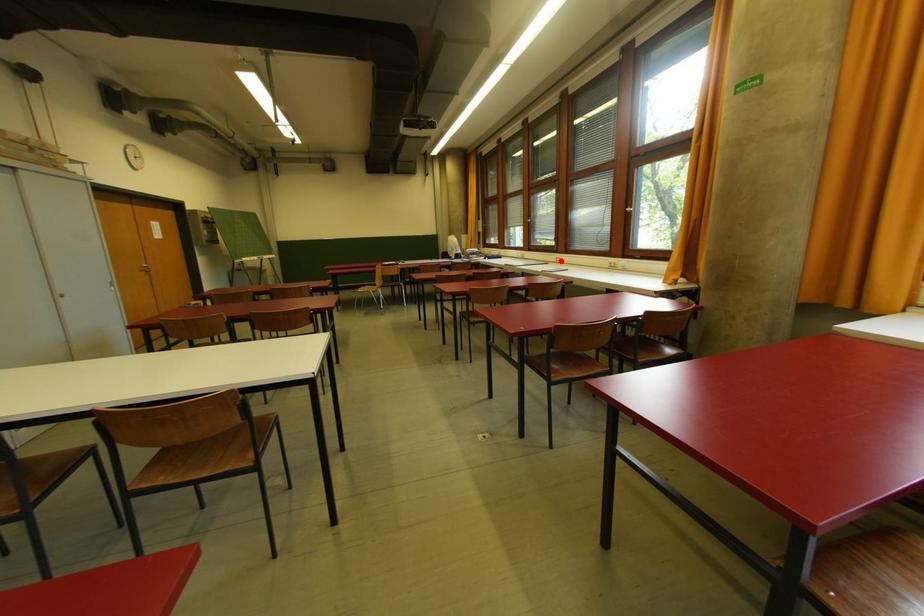
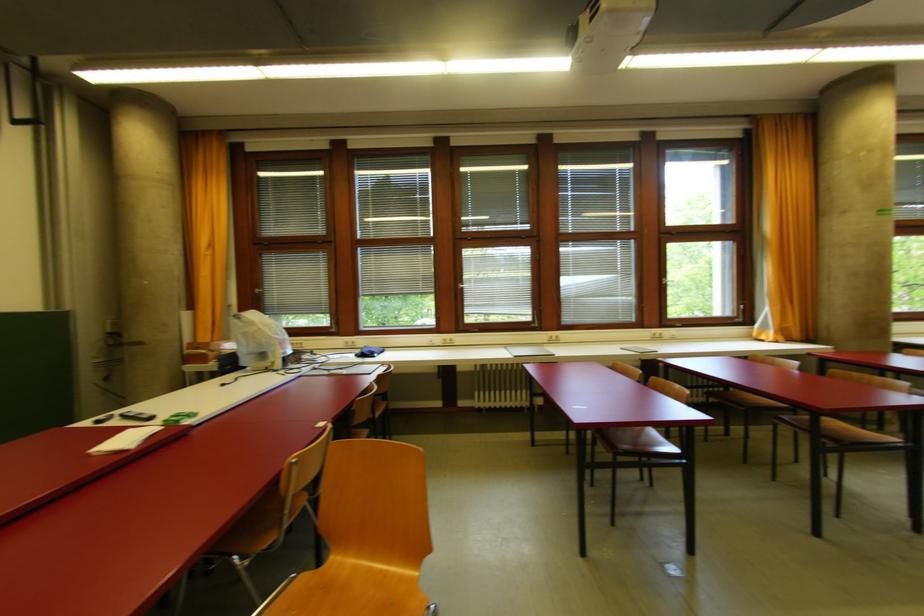
The point at the highlighted location is marked in the first image. Where is the corresponding point in the second image?

(556, 339)